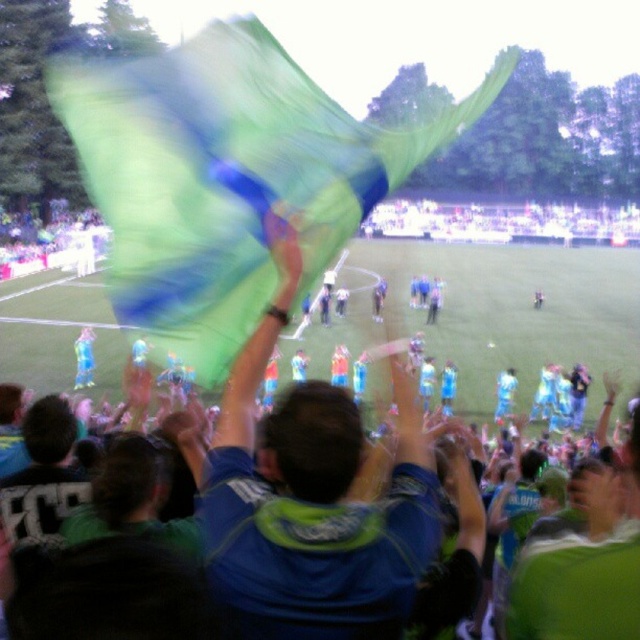
You are a photographer trying to capture a clear shot of both the blue fabric at center and the blue fabric flag at upper center in the image. Given their distance apart, can you fit both into your camera frame which has a maximum field of view of 100 feet? Please explain your reasoning.

The blue fabric at center and the blue fabric flag at upper center are 98.36 feet apart. Since the distance between them is less than the camera frame field of view of 100 feet, both can be captured within the frame.